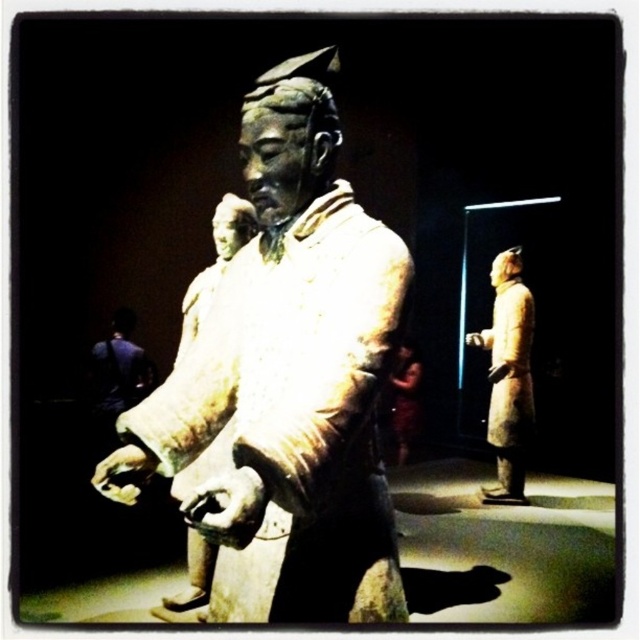
You are a museum curator examining the central warrior statue. You notice two hands on the statue, a smooth bronze hand at center and a smooth clay hand at center. Which hand has a smaller width?

The smooth bronze hand at center is thinner than the smooth clay hand at center, so the smooth bronze hand at center has a smaller width.

You are a tour guide explaining the Terracotta Army exhibit. A visitor asks which warrior is the central figure. Based on the coordinates provided, can you identify the warrior located at point (292, 372)?

The point (292, 372) marks the matte bronze warrior at center, which is the central figure in the exhibit.